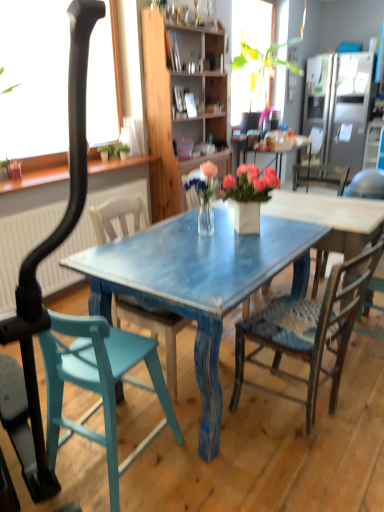
Question: Is wooden chair with woven seat at center, which appears as the third chair when viewed from the left, aimed at teal painted wood chair at lower left, acting as the 1th chair starting from the left?

Choices:
 (A) no
 (B) yes

Answer: (A)

Question: From a real-world perspective, is wooden chair with woven seat at center, arranged as the 2th chair when viewed from the right, physically above teal painted wood chair at lower left, acting as the 1th chair starting from the left?

Choices:
 (A) yes
 (B) no

Answer: (A)

Question: Considering the relative sizes of wooden chair with woven seat at center, which appears as the third chair when viewed from the left, and teal painted wood chair at lower left, acting as the 1th chair starting from the left, in the image provided, is wooden chair with woven seat at center, which appears as the third chair when viewed from the left, taller than teal painted wood chair at lower left, acting as the 1th chair starting from the left,?

Choices:
 (A) no
 (B) yes

Answer: (B)

Question: Is teal painted wood chair at lower left, positioned as the 4th chair in right-to-left order, a part of wooden chair with woven seat at center, arranged as the 2th chair when viewed from the right?

Choices:
 (A) yes
 (B) no

Answer: (B)

Question: Does wooden chair with woven seat at center, arranged as the 2th chair when viewed from the right, lie behind teal painted wood chair at lower left, acting as the 1th chair starting from the left?

Choices:
 (A) yes
 (B) no

Answer: (A)

Question: Would you consider wooden chair with woven seat at center, arranged as the 2th chair when viewed from the right, to be distant from teal painted wood chair at lower left, positioned as the 4th chair in right-to-left order?

Choices:
 (A) yes
 (B) no

Answer: (B)

Question: Is wooden chair with woven seat at center, arranged as the 2th chair when viewed from the right, in front of satin silver refrigerator at upper right?

Choices:
 (A) yes
 (B) no

Answer: (A)

Question: From a real-world perspective, is wooden chair with woven seat at center, arranged as the 2th chair when viewed from the right, on satin silver refrigerator at upper right?

Choices:
 (A) no
 (B) yes

Answer: (A)

Question: Can you confirm if wooden chair with woven seat at center, which appears as the third chair when viewed from the left, is positioned to the right of satin silver refrigerator at upper right?

Choices:
 (A) no
 (B) yes

Answer: (A)

Question: From a real-world perspective, is wooden chair with woven seat at center, arranged as the 2th chair when viewed from the right, physically below satin silver refrigerator at upper right?

Choices:
 (A) yes
 (B) no

Answer: (A)

Question: Is wooden chair with woven seat at center, which appears as the third chair when viewed from the left, surrounding satin silver refrigerator at upper right?

Choices:
 (A) yes
 (B) no

Answer: (B)

Question: Can you confirm if wooden chair with woven seat at center, arranged as the 2th chair when viewed from the right, is taller than satin silver refrigerator at upper right?

Choices:
 (A) no
 (B) yes

Answer: (A)

Question: Does satin silver refrigerator at upper right turn towards teal wood chair at center, which appears as the 3th chair when viewed from the right?

Choices:
 (A) yes
 (B) no

Answer: (A)